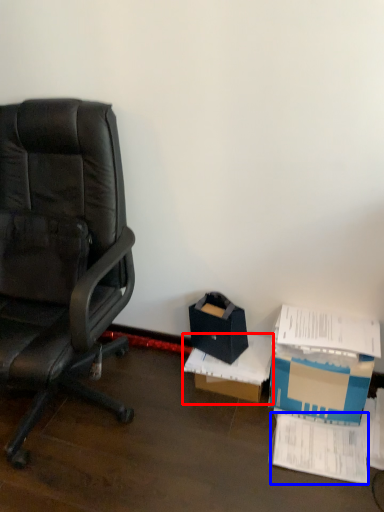
Question: Which of the following is the closest to the observer, cardboard box (highlighted by a red box) or paperback book (highlighted by a blue box)?

Choices:
 (A) cardboard box
 (B) paperback book

Answer: (B)